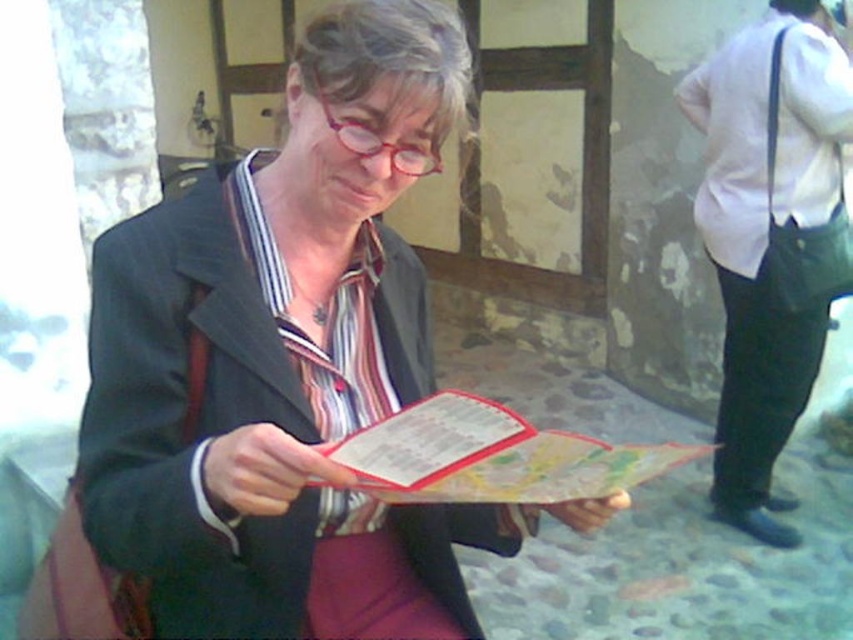
Question: Which object is the farthest from the white cotton shirt at right?

Choices:
 (A) matte black jacket at center
 (B) map paper at center

Answer: (B)

Question: Is white cotton shirt at right to the right of map paper at center from the viewer's perspective?

Choices:
 (A) yes
 (B) no

Answer: (A)

Question: Does white cotton shirt at right appear under map paper at center?

Choices:
 (A) no
 (B) yes

Answer: (A)

Question: Which point is farther to the camera?

Choices:
 (A) matte black jacket at center
 (B) white cotton shirt at right

Answer: (B)

Question: Is matte black jacket at center bigger than white cotton shirt at right?

Choices:
 (A) no
 (B) yes

Answer: (A)

Question: Which point is farther to the camera?

Choices:
 (A) map paper at center
 (B) matte black jacket at center
 (C) white cotton shirt at right

Answer: (C)